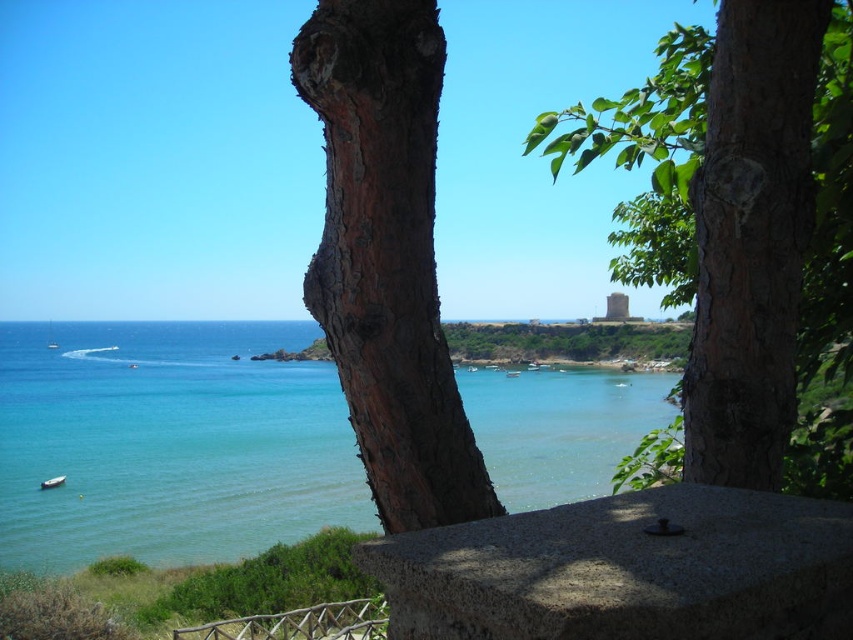
Question: Is clear blue water at center thinner than gray stone balustrade at lower center?

Choices:
 (A) no
 (B) yes

Answer: (A)

Question: Which point appears farthest from the camera in this image?

Choices:
 (A) (502, 513)
 (B) (312, 509)
 (C) (811, 131)
 (D) (44, 481)

Answer: (D)

Question: Which of the following is the closest to the observer?

Choices:
 (A) (415, 204)
 (B) (708, 160)

Answer: (A)

Question: Which of the following is the closest to the observer?

Choices:
 (A) (316, 70)
 (B) (671, 410)
 (C) (392, 560)
 (D) (62, 483)

Answer: (C)

Question: Does brown rough bark at center come in front of gray stone balustrade at lower center?

Choices:
 (A) yes
 (B) no

Answer: (B)

Question: In this image, where is gray stone balustrade at lower center located relative to white plastic boat at lower left?

Choices:
 (A) above
 (B) below

Answer: (A)